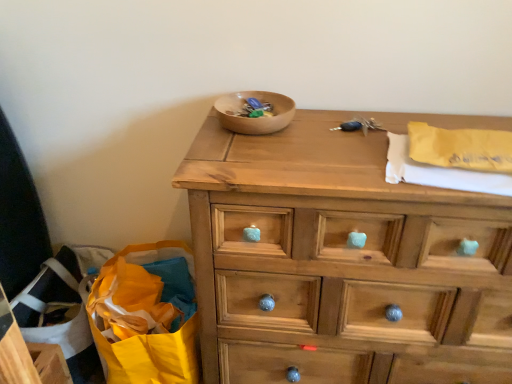
Locate an element on the screen. blank space situated above wooden chest of drawers at center (from a real-world perspective) is located at coordinates (372, 143).